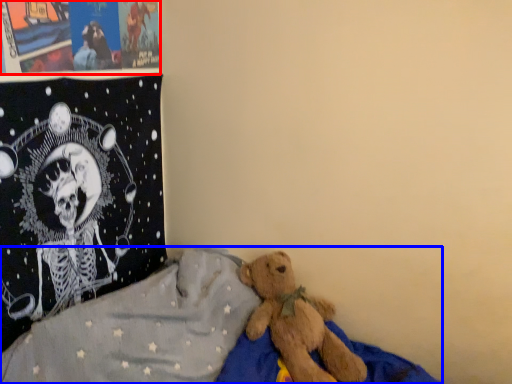
Question: Which object appears farthest to the camera in this image, poster page (highlighted by a red box) or bed (highlighted by a blue box)?

Choices:
 (A) poster page
 (B) bed

Answer: (A)